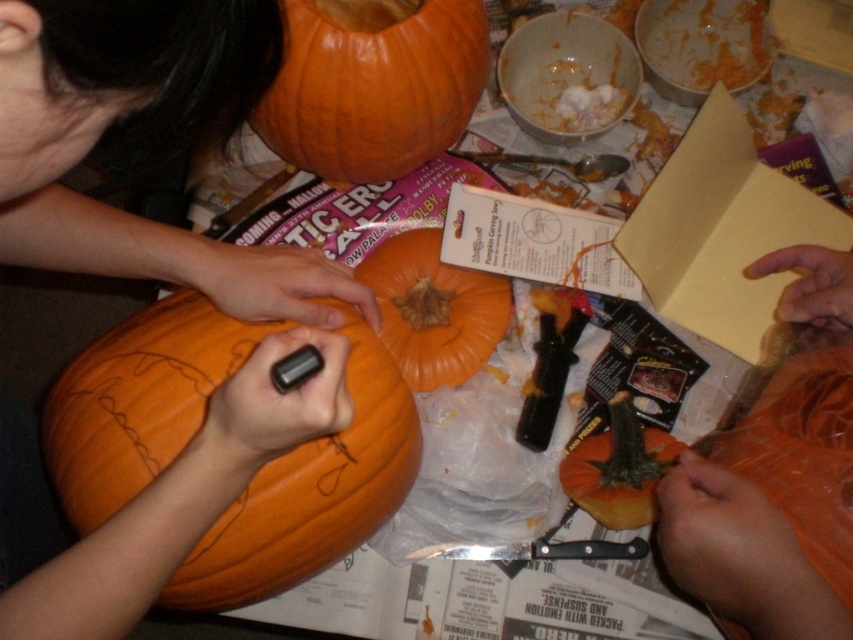
You are standing in front of the table where people are carving pumpkins. There are two points marked on the table surface. One is at coordinates point (38, 576) and the other is at point (506, 307). Which point is closer to you?

Point (38, 576) is closer to the viewer than point (506, 307).

You are organizing a Halloween pumpkin carving event and need to arrange the pumpkins in a straight line from left to right. Given the current positions of the orange matte pumpkin at center and orange matte pumpkin at lower right, which pumpkin should be placed first in the line?

The orange matte pumpkin at center should be placed first in the line since it is already positioned to the left of the orange matte pumpkin at lower right.